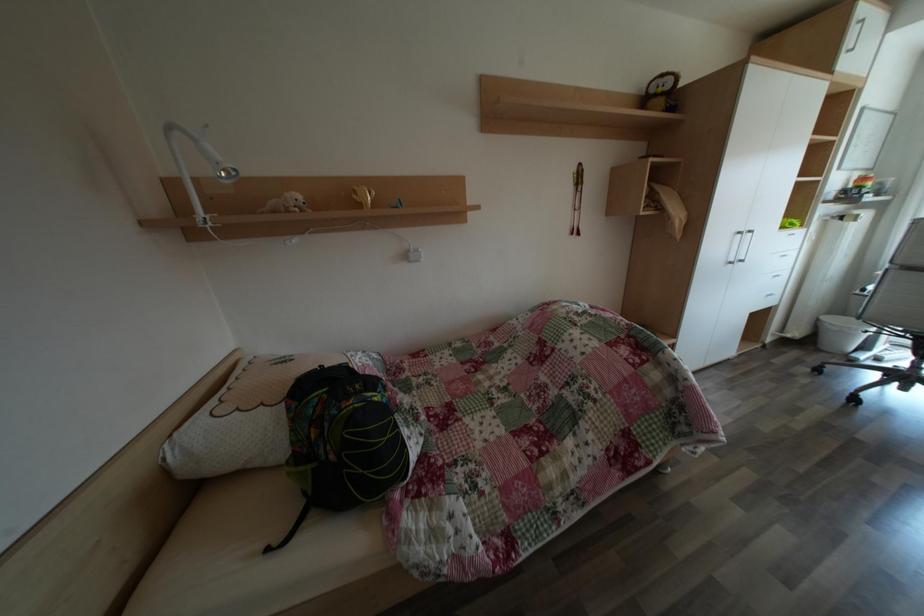
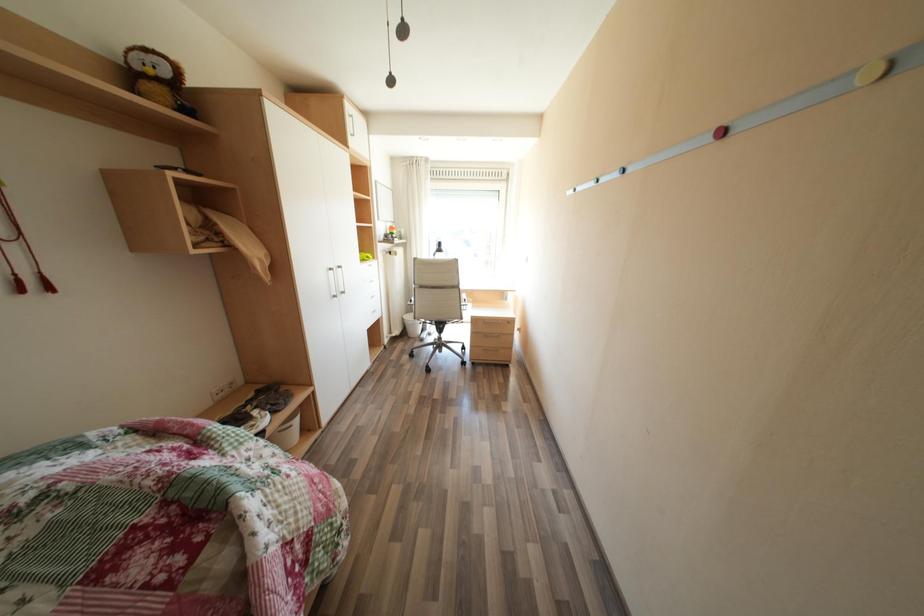
Question: How did the camera likely rotate?

Choices:
 (A) Left
 (B) Right
 (C) Up
 (D) Down

Answer: (B)